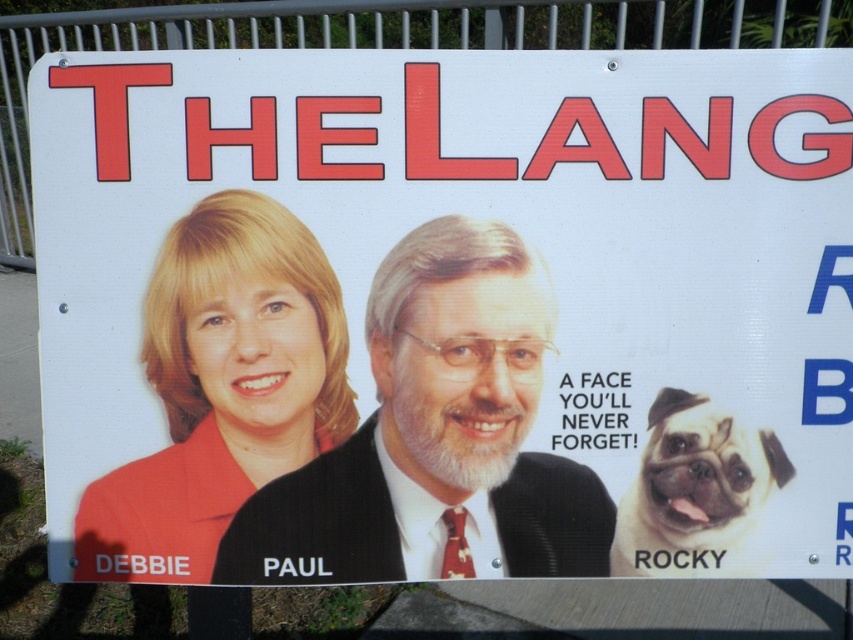
Looking at the political campaign sign described, which object is positioned to the left of the other between the matte black suit at center and the white fur dog at lower right?

The matte black suit at center is positioned to the left of the white fur dog at lower right.

Based on the scene description, which object is taller, the matte black suit at center or the white fur dog at lower right?

The matte black suit at center is taller than the white fur dog at lower right according to the description.